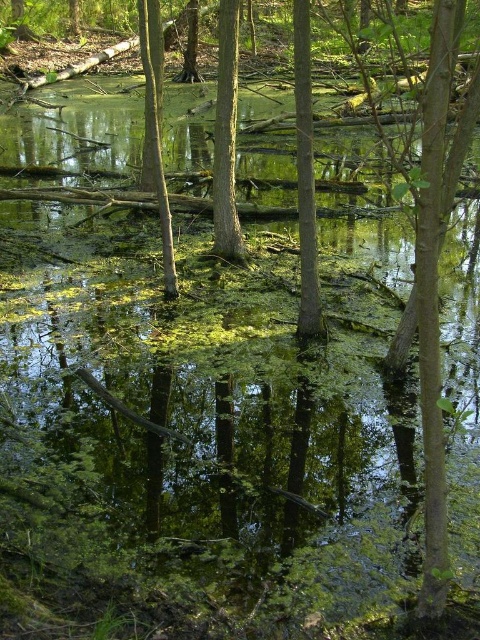
Question: Which of the following is the farthest from the observer?

Choices:
 (A) smooth bark tree at center
 (B) green rough bark tree at center
 (C) smooth brown tree trunk at center

Answer: (B)

Question: Which point is closer to the camera?

Choices:
 (A) (219, 166)
 (B) (301, 284)
 (C) (149, 150)

Answer: (B)

Question: Observing the image, what is the correct spatial positioning of smooth bark tree at center in reference to smooth brown tree trunk at center?

Choices:
 (A) right
 (B) left

Answer: (A)

Question: Among these objects, which one is nearest to the camera?

Choices:
 (A) green rough bark tree at center
 (B) smooth brown tree trunk at center
 (C) smooth bark tree at center

Answer: (C)

Question: Does smooth bark tree at center appear under smooth brown tree trunk at center?

Choices:
 (A) yes
 (B) no

Answer: (B)

Question: Is smooth bark tree at center below smooth brown tree trunk at center?

Choices:
 (A) no
 (B) yes

Answer: (A)